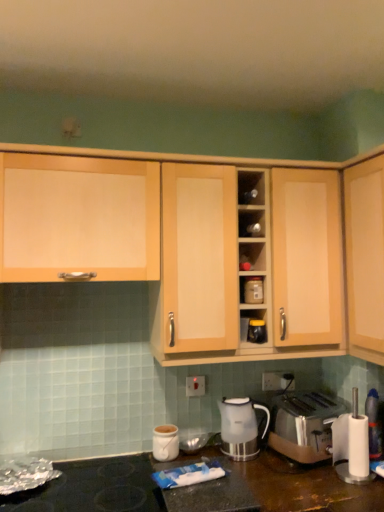
Question: Is black matte gas stove at lower left in front of or behind matte plastic container at center, which is counted as the 1th appliance, starting from the top, in the image?

Choices:
 (A) behind
 (B) front

Answer: (B)

Question: Would you say black matte gas stove at lower left is inside or outside matte plastic container at center, which is counted as the 1th appliance, starting from the top?

Choices:
 (A) outside
 (B) inside

Answer: (A)

Question: Which is farther from the light wood cabinet at center, arranged as the 2th cabinetry when viewed from the left?

Choices:
 (A) light wood cabinet at upper left, placed as the third cabinetry when sorted from right to left
 (B) matte plastic container at center, the 2th appliance when ordered from bottom to top
 (C) white glossy kettle at lower center
 (D) light wood cabinet at upper right, the 1th cabinetry from the right
 (E) white plastic blender at lower right

Answer: (E)

Question: Which is farther from the satin gold toaster at lower right?

Choices:
 (A) light wood cabinet at upper left, placed as the third cabinetry when sorted from right to left
 (B) light wood cabinet at upper right, the third cabinetry viewed from the left
 (C) matte plastic container at center, the 2th appliance when ordered from bottom to top
 (D) white ceramic mug at lower center
 (E) metallic silver toaster at center, the 1th appliance in the bottom-to-top sequence

Answer: (A)